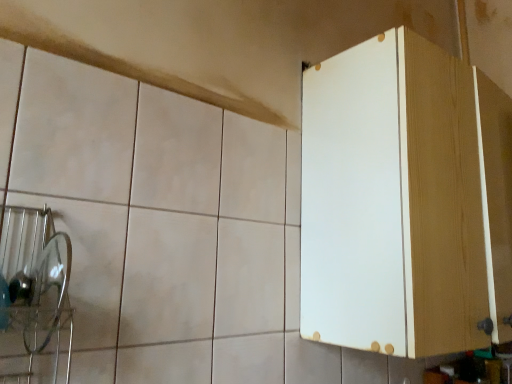
Question: From the image's perspective, is white wood cabinet at right on top of translucent glass plate at left?

Choices:
 (A) yes
 (B) no

Answer: (A)

Question: Is white wood cabinet at right looking in the opposite direction of translucent glass plate at left?

Choices:
 (A) yes
 (B) no

Answer: (B)

Question: Can you confirm if white wood cabinet at right is wider than translucent glass plate at left?

Choices:
 (A) yes
 (B) no

Answer: (A)

Question: Considering the relative sizes of white wood cabinet at right and translucent glass plate at left in the image provided, is white wood cabinet at right bigger than translucent glass plate at left?

Choices:
 (A) no
 (B) yes

Answer: (B)

Question: From the image's perspective, would you say white wood cabinet at right is shown under translucent glass plate at left?

Choices:
 (A) no
 (B) yes

Answer: (A)

Question: Considering the relative sizes of white wood cabinet at right and translucent glass plate at left in the image provided, is white wood cabinet at right taller than translucent glass plate at left?

Choices:
 (A) no
 (B) yes

Answer: (B)

Question: Does translucent glass plate at left appear on the left side of white wood cabinet at right?

Choices:
 (A) yes
 (B) no

Answer: (A)

Question: Can we say translucent glass plate at left lies outside white wood cabinet at right?

Choices:
 (A) no
 (B) yes

Answer: (B)

Question: Would you say white wood cabinet at right is part of translucent glass plate at left's contents?

Choices:
 (A) yes
 (B) no

Answer: (B)

Question: Does translucent glass plate at left have a greater height compared to white wood cabinet at right?

Choices:
 (A) no
 (B) yes

Answer: (A)

Question: Is translucent glass plate at left bigger than white wood cabinet at right?

Choices:
 (A) yes
 (B) no

Answer: (B)

Question: Is translucent glass plate at left facing towards white wood cabinet at right?

Choices:
 (A) no
 (B) yes

Answer: (A)

Question: In terms of height, does white wood cabinet at right look taller or shorter compared to translucent glass plate at left?

Choices:
 (A) short
 (B) tall

Answer: (B)